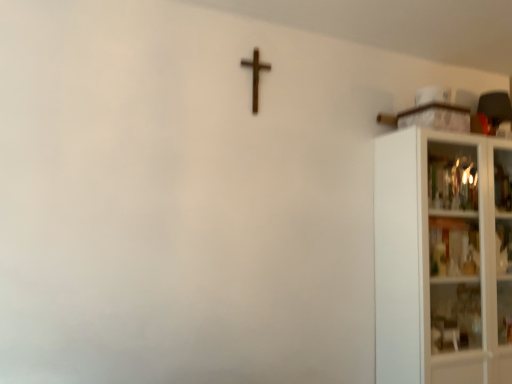
Question: Does white glass cabinet at right touch wooden cross at upper center?

Choices:
 (A) yes
 (B) no

Answer: (B)

Question: Is white glass cabinet at right oriented towards wooden cross at upper center?

Choices:
 (A) yes
 (B) no

Answer: (B)

Question: Is white glass cabinet at right not near wooden cross at upper center?

Choices:
 (A) yes
 (B) no

Answer: (A)

Question: Is the position of white glass cabinet at right more distant than that of wooden cross at upper center?

Choices:
 (A) no
 (B) yes

Answer: (A)

Question: Is white glass cabinet at right not within wooden cross at upper center?

Choices:
 (A) no
 (B) yes

Answer: (B)

Question: Does white glass cabinet at right have a larger size compared to wooden cross at upper center?

Choices:
 (A) no
 (B) yes

Answer: (B)

Question: From a real-world perspective, is wooden cross at upper center physically below white glass cabinet at right?

Choices:
 (A) yes
 (B) no

Answer: (B)

Question: Considering the relative sizes of wooden cross at upper center and white glass cabinet at right in the image provided, is wooden cross at upper center bigger than white glass cabinet at right?

Choices:
 (A) yes
 (B) no

Answer: (B)

Question: Is wooden cross at upper center positioned before white glass cabinet at right?

Choices:
 (A) no
 (B) yes

Answer: (A)

Question: Considering the relative sizes of wooden cross at upper center and white glass cabinet at right in the image provided, is wooden cross at upper center thinner than white glass cabinet at right?

Choices:
 (A) no
 (B) yes

Answer: (B)

Question: Is wooden cross at upper center at the left side of white glass cabinet at right?

Choices:
 (A) yes
 (B) no

Answer: (A)

Question: Is wooden cross at upper center directly adjacent to white glass cabinet at right?

Choices:
 (A) yes
 (B) no

Answer: (B)

Question: Is white glass cabinet at right inside the boundaries of wooden cross at upper center, or outside?

Choices:
 (A) outside
 (B) inside

Answer: (A)